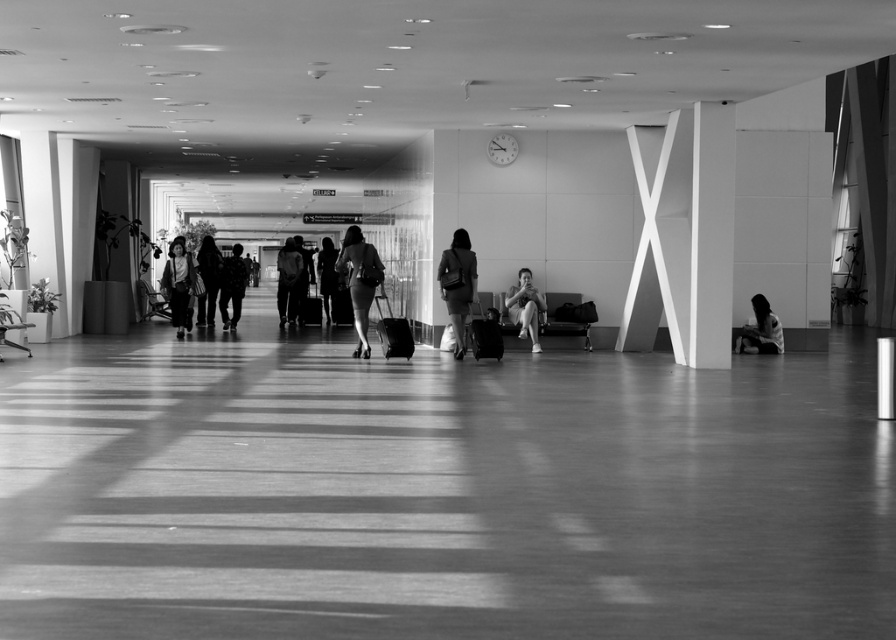
You are a security officer in the airport corridor and need to quickly assess if the matte black bag at center can fit through a narrow security checkpoint gate that only allows items thinner than the matte black dress at center. Can it pass through?

The matte black bag at center is thinner than the matte black dress at center, so it can pass through the security checkpoint gate.

You are an airport security agent checking the layout of the terminal. You notice a smooth skin person at lower right and a smooth black dress at center. Which object takes up more area in the image?

The smooth black dress at center occupies more space than the smooth skin person at lower right, so the smooth black dress at center takes up more area in the image.

You are standing in the corridor and see a smooth skin person at lower right and a smooth black dress at center. Which object is nearer to you?

The smooth skin person at lower right is closer to the viewer than the smooth black dress at center.